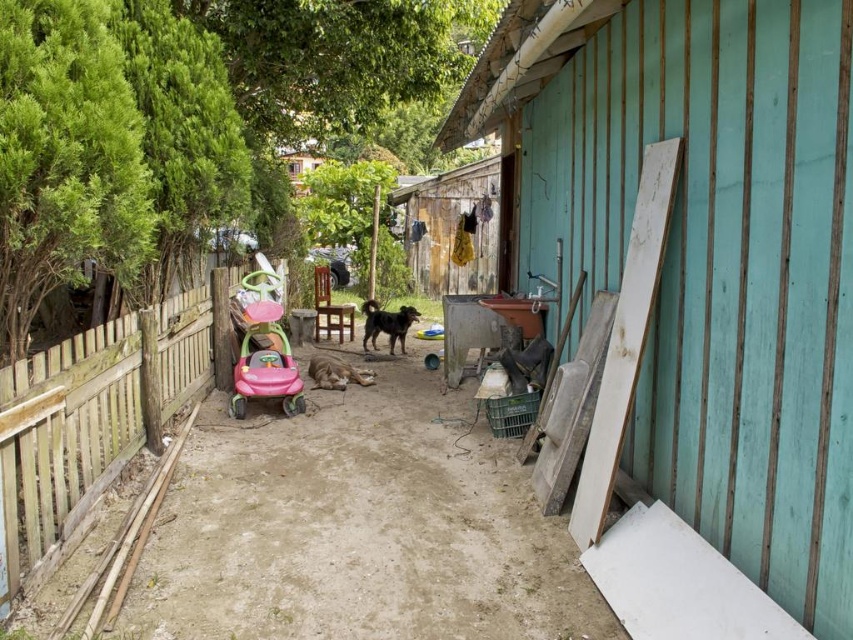
Is wooden boards at right above wooden fence at left?

Yes, wooden boards at right is above wooden fence at left.

The height and width of the screenshot is (640, 853). I want to click on wooden boards at right, so click(x=704, y=252).

The image size is (853, 640). I want to click on wooden boards at right, so click(x=704, y=252).

Is wooden fence at left below pink plastic baby carriage at center?

Indeed, wooden fence at left is positioned under pink plastic baby carriage at center.

Does point (26, 500) come behind point (247, 276)?

No, it is not.

Image resolution: width=853 pixels, height=640 pixels. In order to click on wooden fence at left in this screenshot , I will do `click(91, 422)`.

Which is above, wooden boards at right or pink plastic baby carriage at center?

wooden boards at right is above.

Can you confirm if wooden boards at right is positioned to the left of pink plastic baby carriage at center?

Incorrect, wooden boards at right is not on the left side of pink plastic baby carriage at center.

Find the location of a particular element. This screenshot has height=640, width=853. wooden boards at right is located at coordinates (704, 252).